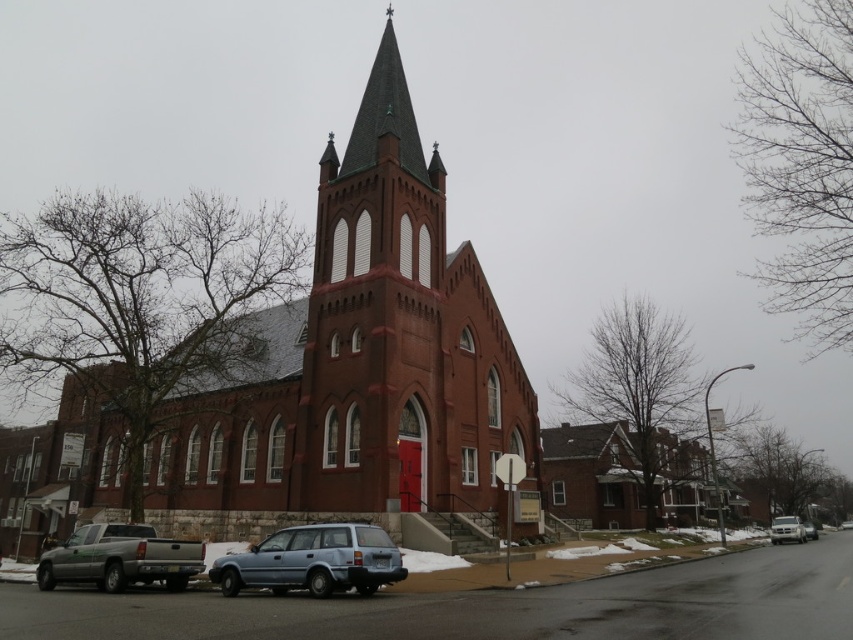
You are driving a silver metallic sedan at lower right and want to park it near the smooth brick tower at center. Considering the height difference between the two, will the sedan be visible from the top of the tower?

The smooth brick tower at center is taller than the silver metallic sedan at lower right, so the sedan will not be visible from the top of the tower because the tower is taller than the sedan.

You are a delivery driver who needs to park your vehicle in the parking lot near the red brick church. You have two options for parking spots next to the silver metallic truck at lower left and the silver metallic sedan at lower right. Which parking spot has more space for your vehicle?

The parking spot next to the silver metallic sedan at lower right has more space because the silver metallic truck at lower left is narrower than the silver metallic sedan at lower right, indicating a wider parking space there.

You are a delivery person with a cart that is 2 meters long. You need to move your light blue matte wagon at lower center closer to the smooth brick tower at center. The path between them is straight. Can your cart fit in the space between them?

The distance between the smooth brick tower at center and the light blue matte wagon at lower center is 14.56 meters. Since your cart is only 2 meters long, there is ample space for it to fit between them.